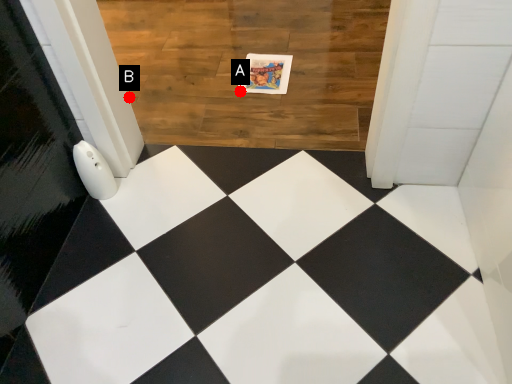
Question: Two points are circled on the image, labeled by A and B beside each circle. Which point appears closest to the camera in this image?

Choices:
 (A) A is closer
 (B) B is closer

Answer: (A)